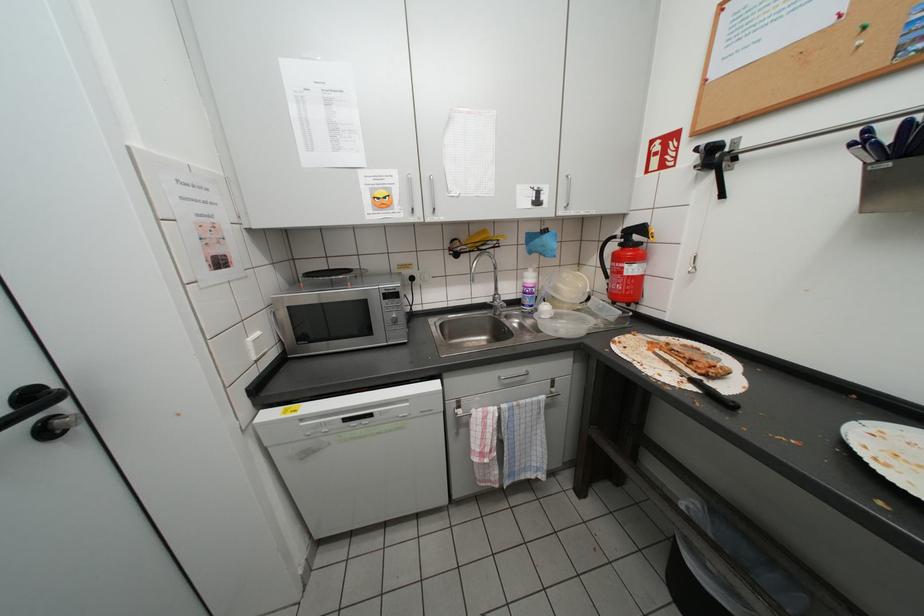
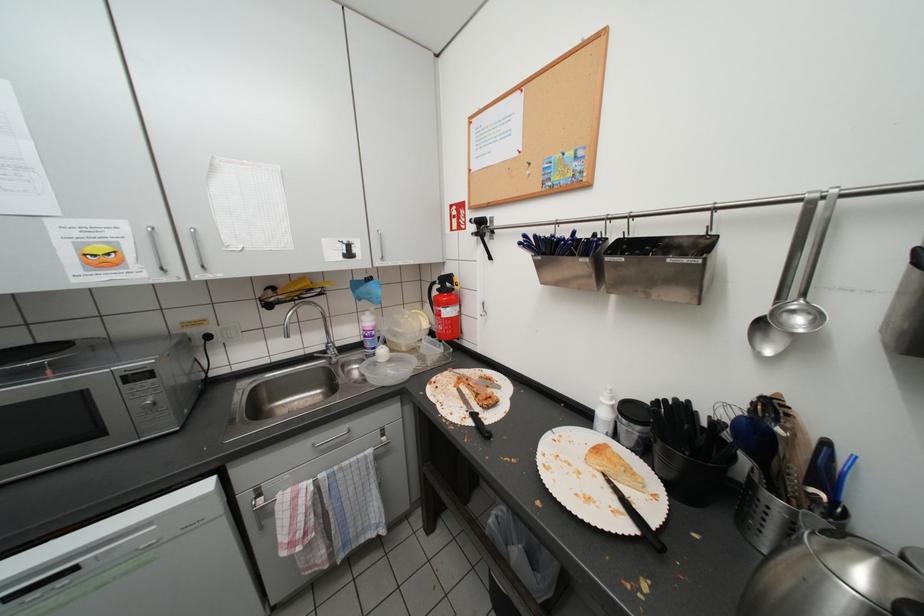
Question: The first image is from the beginning of the video and the second image is from the end. How did the camera likely rotate when shooting the video?

Choices:
 (A) Left
 (B) Right
 (C) Up
 (D) Down

Answer: (B)